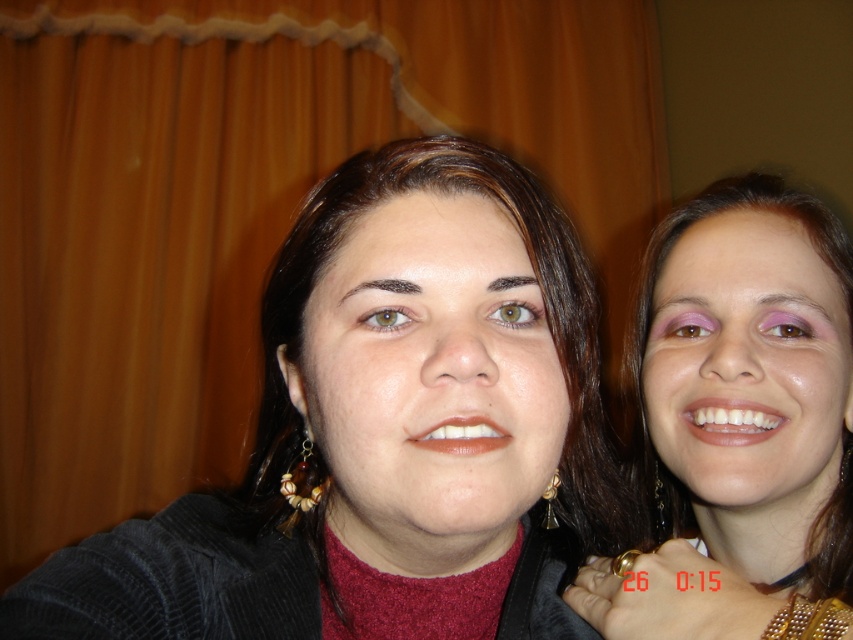
You are a photographer trying to capture a closeup shot of both the matte black sweater at center and the matte black hair at right. Given that your camera can only focus on objects within a 5 inch range, will you be able to get both in focus?

The matte black sweater at center is 5.26 inches from the matte black hair at right, which is slightly beyond the 5 inch range, so the camera may not be able to focus on both simultaneously.

You are a photographer setting up a shot. You want to ensure the matte black sweater at center is in focus. Given that your camera has a depth of field that can sharply focus objects within 12 inches, can you confirm if the sweater will be in focus?

The matte black sweater at center is 13.50 inches from the camera, which is beyond the 12 inch depth of field range. Therefore, the sweater will not be in focus.